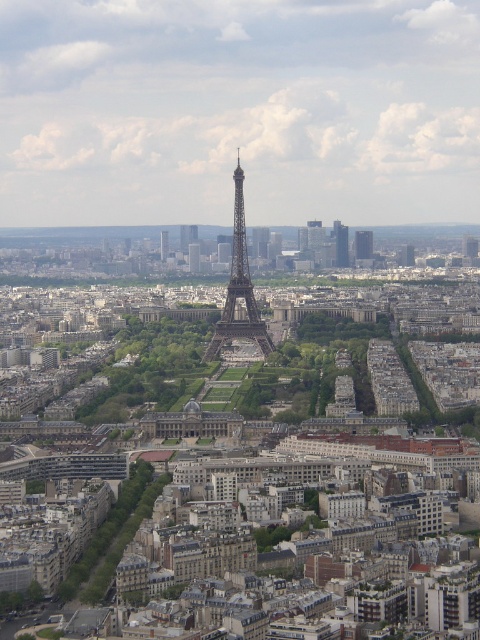
Does point (250, 339) come closer to viewer compared to point (167, 236)?

Yes.

Locate an element on the screen. shiny metallic eiffel tower at center is located at coordinates (239, 289).

Describe the element at coordinates (362, 244) in the screenshot. I see `glassy reflective skyscraper at center` at that location.

Find the location of a particular element. This screenshot has height=640, width=480. glassy reflective skyscraper at center is located at coordinates (362, 244).

Is shiny metallic eiffel tower at center wider than glassy skyscraper at center right?

Yes, shiny metallic eiffel tower at center is wider than glassy skyscraper at center right.

Is point (218, 333) more distant than point (347, 227)?

No, it is not.

Where is `shiny metallic eiffel tower at center`? shiny metallic eiffel tower at center is located at coordinates (239, 289).